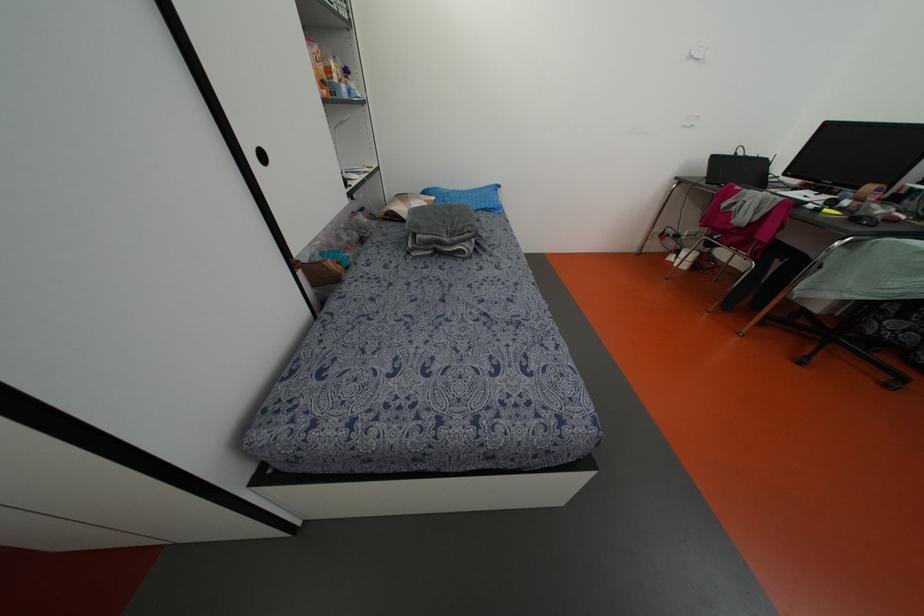
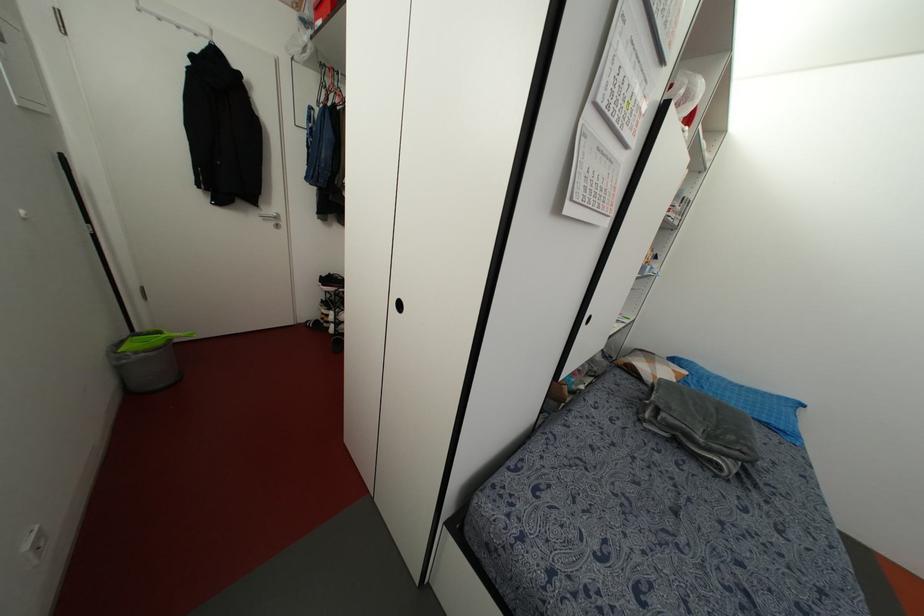
Question: The images are taken continuously from a first-person perspective. In which direction is your viewpoint rotating?

Choices:
 (A) Left
 (B) Right
 (C) Up
 (D) Down

Answer: (A)